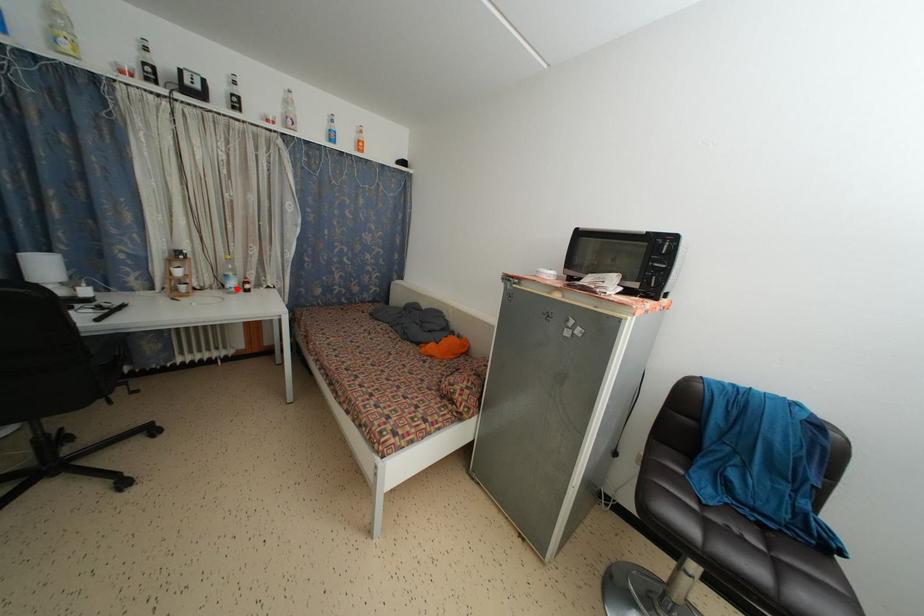
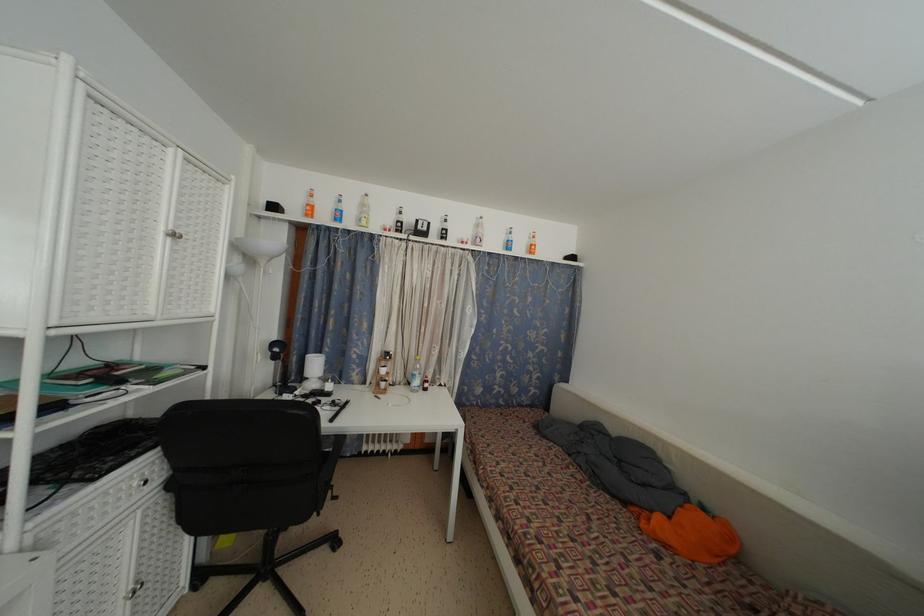
Question: I am providing you with two images of the same scene from different viewpoints. Image1 has a red point marked. In image2, the corresponding 3D location appears at what relative position? Reply with the corresponding letter.

Choices:
 (A) Closer
 (B) Farther

Answer: (B)